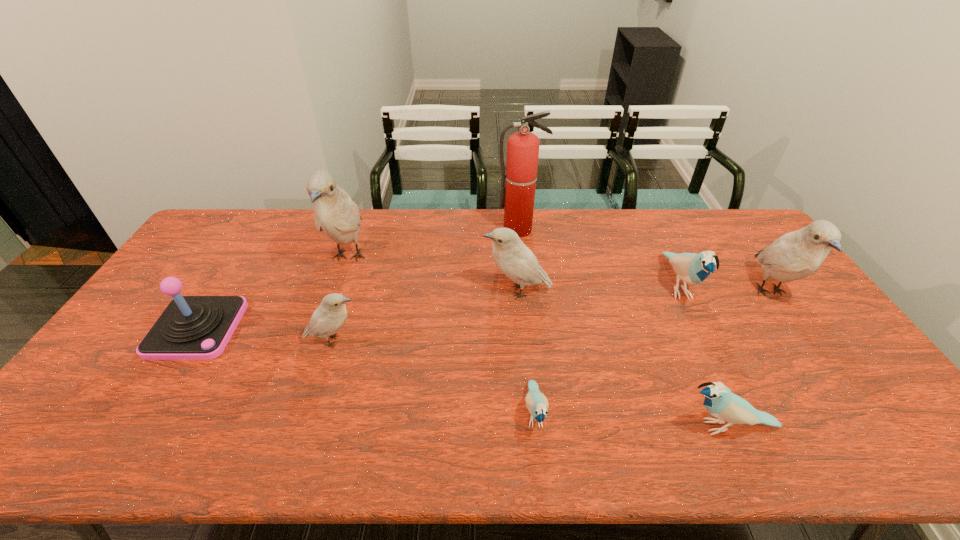
You are a GUI agent. You are given a task and a screenshot of the screen. Output one action in this format:
    pyautogui.click(x=<x>, y=<y>)
    Task: Click on the object positioned at the right edge
    Image resolution: width=960 pixels, height=540 pixels.
    Given the screenshot: What is the action you would take?
    pyautogui.click(x=796, y=255)

Where is `free spot at the far edge of the desktop`? This screenshot has height=540, width=960. free spot at the far edge of the desktop is located at coordinates (424, 215).

The height and width of the screenshot is (540, 960). What are the coordinates of `vacant position at the near edge of the desktop` in the screenshot? It's located at (580, 437).

At what (x,y) coordinates should I click in order to perform the action: click on blank space at the left edge. Please return your answer as a coordinate pair (x, y). The height and width of the screenshot is (540, 960). Looking at the image, I should click on (195, 259).

Identify the location of free location at the right edge. (751, 276).

Identify the location of free area in between the biggest white bird and the red fire extinguisher. (434, 244).

What are the coordinates of `free space between the tallest bird and the leftmost blue bird` in the screenshot? It's located at click(442, 336).

This screenshot has width=960, height=540. I want to click on vacant space in between the second smallest blue bird and the second tallest object, so click(539, 342).

At what (x,y) coordinates should I click in order to perform the action: click on vacant space that is in between the smallest white bird and the second biggest white bird. Please return your answer as a coordinate pair (x, y). This screenshot has width=960, height=540. Looking at the image, I should click on (552, 316).

Identify the location of free space that is in between the second tallest bird and the second smallest white bird. The image size is (960, 540). (643, 292).